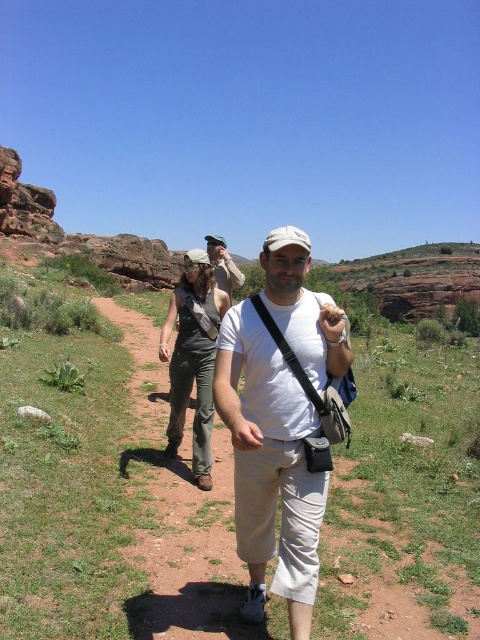
Does denim overalls at center have a lesser width compared to matte khaki pants at center?

Yes.

Based on the photo, does denim overalls at center have a smaller size compared to matte khaki pants at center?

Yes.

Who is more distant from viewer, (206, 296) or (228, 253)?

The point (228, 253) is more distant.

You are a GUI agent. You are given a task and a screenshot of the screen. Output one action in this format:
    pyautogui.click(x=<x>, y=<y>)
    Task: Click on the denim overalls at center
    This screenshot has height=640, width=480.
    Given the screenshot: What is the action you would take?
    [x=192, y=356]

Can you confirm if white cotton shirt at center is shorter than denim overalls at center?

No, white cotton shirt at center is not shorter than denim overalls at center.

Based on the photo, does white cotton shirt at center have a lesser width compared to denim overalls at center?

Indeed, white cotton shirt at center has a lesser width compared to denim overalls at center.

What are the coordinates of `white cotton shirt at center` in the screenshot? It's located at (282, 420).

Where is `white cotton shirt at center`? white cotton shirt at center is located at coordinates (282, 420).

Can you confirm if white cotton shirt at center is positioned to the right of matte khaki pants at center?

Yes, white cotton shirt at center is to the right of matte khaki pants at center.

Is white cotton shirt at center below matte khaki pants at center?

Indeed, white cotton shirt at center is positioned under matte khaki pants at center.

Which is in front, point (280, 492) or point (224, 248)?

Point (280, 492)

Find the location of `white cotton shirt at center`. white cotton shirt at center is located at coordinates (282, 420).